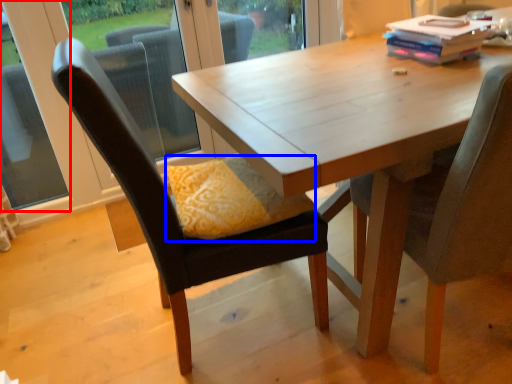
Question: Which point is further to the camera, window (highlighted by a red box) or pillow (highlighted by a blue box)?

Choices:
 (A) window
 (B) pillow

Answer: (A)